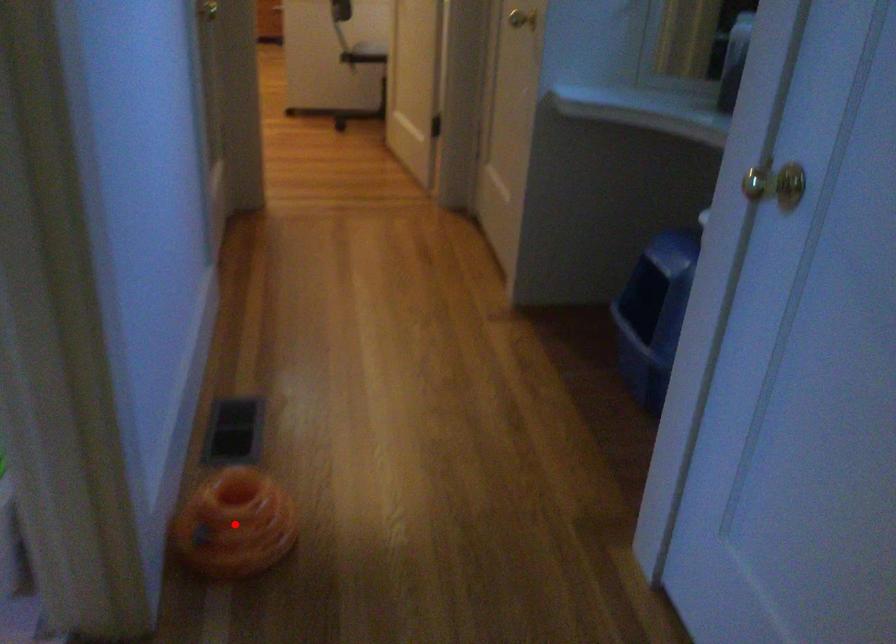
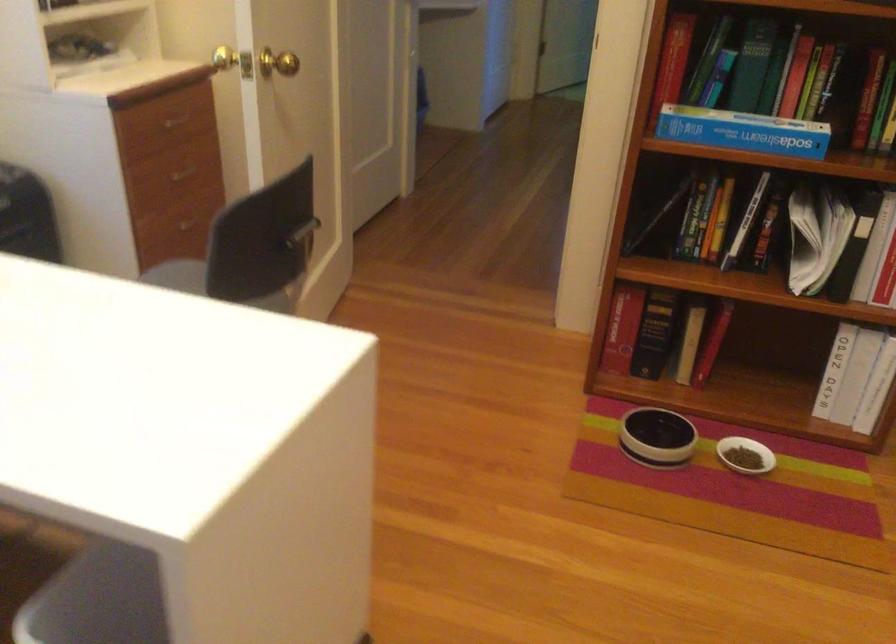
Question: I am providing you with two images of the same scene from different viewpoints. A red point is marked on the first image. Is the red point's position out of view in image 2?

Choices:
 (A) Yes
 (B) No

Answer: (A)